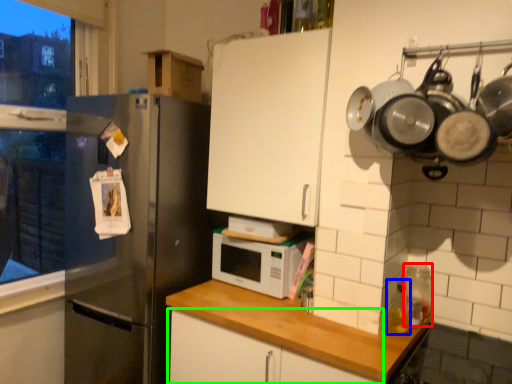
Question: Considering the real-world distances, which object is farthest from appliance (highlighted by a red box)? bottle (highlighted by a blue box) or cabinetry (highlighted by a green box)?

Choices:
 (A) bottle
 (B) cabinetry

Answer: (B)